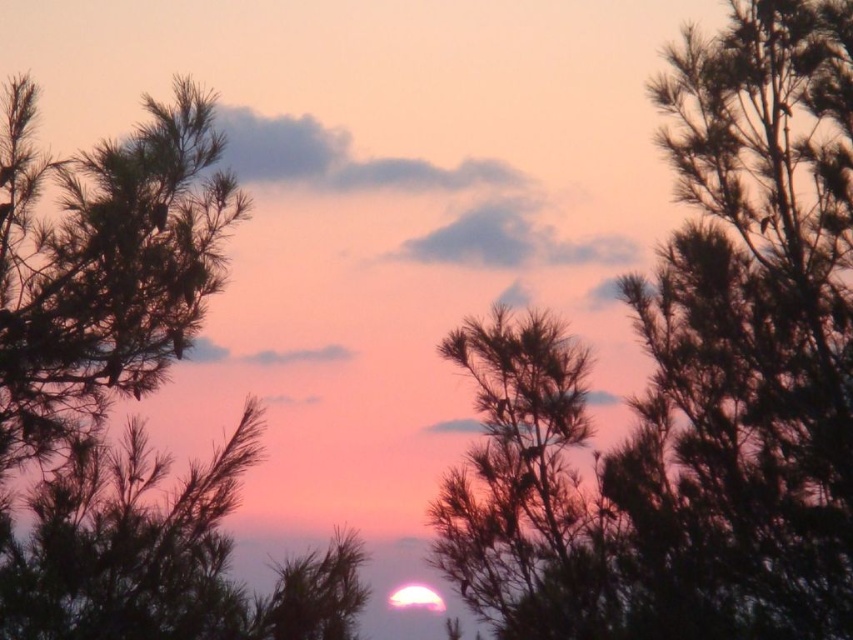
You are an artist painting the sunset scene. You have two trees in the center, a silky dark green tree at center and a green matte tree at center. Which tree is wider?

The silky dark green tree at center is wider than the green matte tree at center.

You are an astronomer observing the sunset and notice two points in the sky, one at point (665, 148) and the other at point (74, 612). Which point is closer to the horizon?

Point (74, 612) is closer to the horizon because it has a lower y coordinate than point (665, 148).